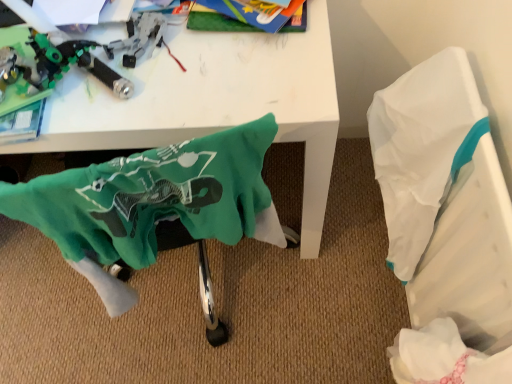
Identify the location of blank area beneath white glossy table at upper center (from a real-world perspective). The image size is (512, 384). (200, 280).